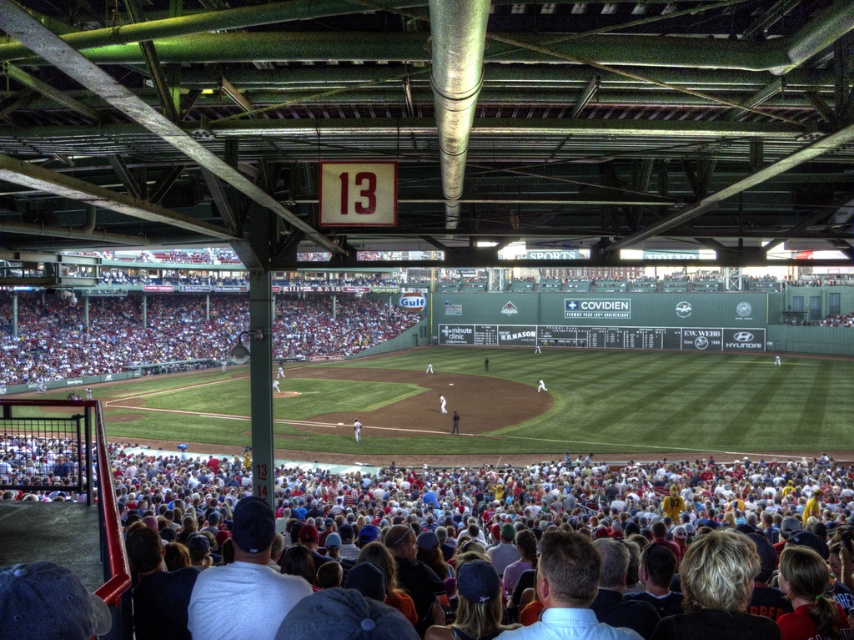
You are sitting in the stands at Fenway Park and want to point out two specific points in the image. The first point is at coordinates point (624, 496) and the second is at point (443, 396). Which of these two points is physically closer to your current position?

Point (624, 496) is closer to the viewer than point (443, 396).

You are a photographer standing in the stands at Fenway Park. You notice a dark brown leather jacket at center and a white fabric cap at center. Which object is closer to the ground?

The dark brown leather jacket at center is closer to the ground because it is located below the white fabric cap at center.

You are sitting in the lower section of Fenway Park watching the game. You notice two points marked in the image. The first point is at coordinate (455, 422) and the second is at (537, 381). From your seat, which point is closer to you?

Point (455, 422) is in front of point (537, 381), so it is closer to you.